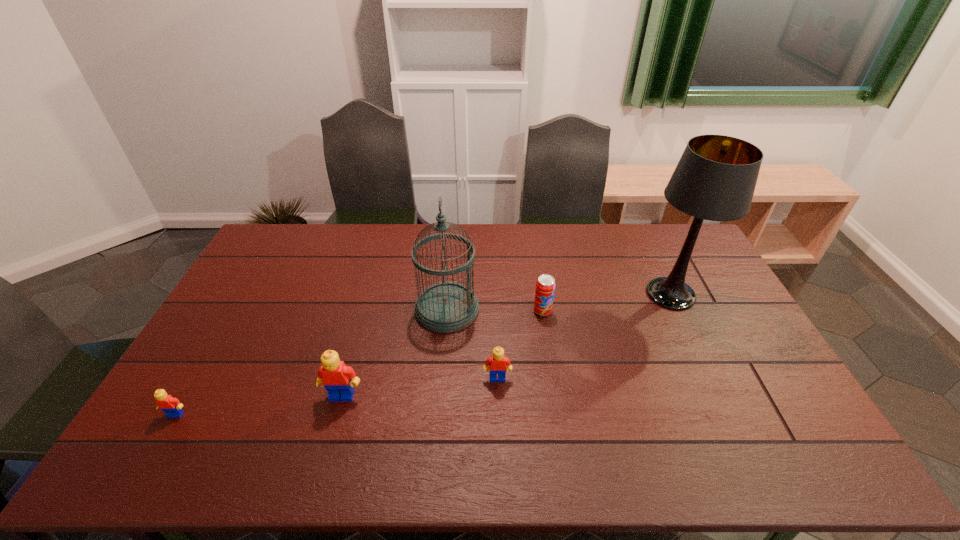
You are a GUI agent. You are given a task and a screenshot of the screen. Output one action in this format:
    pyautogui.click(x=<x>, y=<y>)
    Task: Click on the free point that keeps the Legos evenly spaced on the right
    
    Given the screenshot: What is the action you would take?
    pyautogui.click(x=642, y=362)